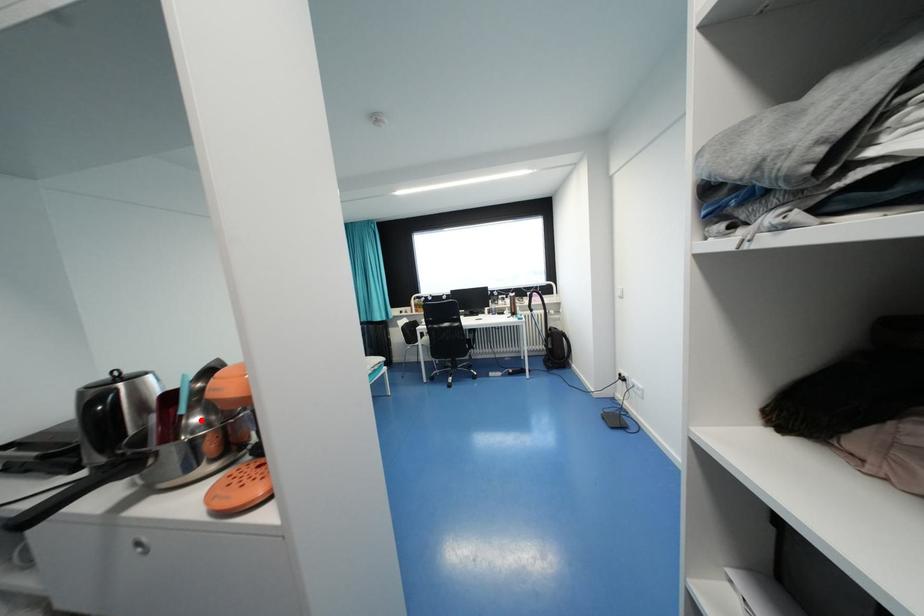
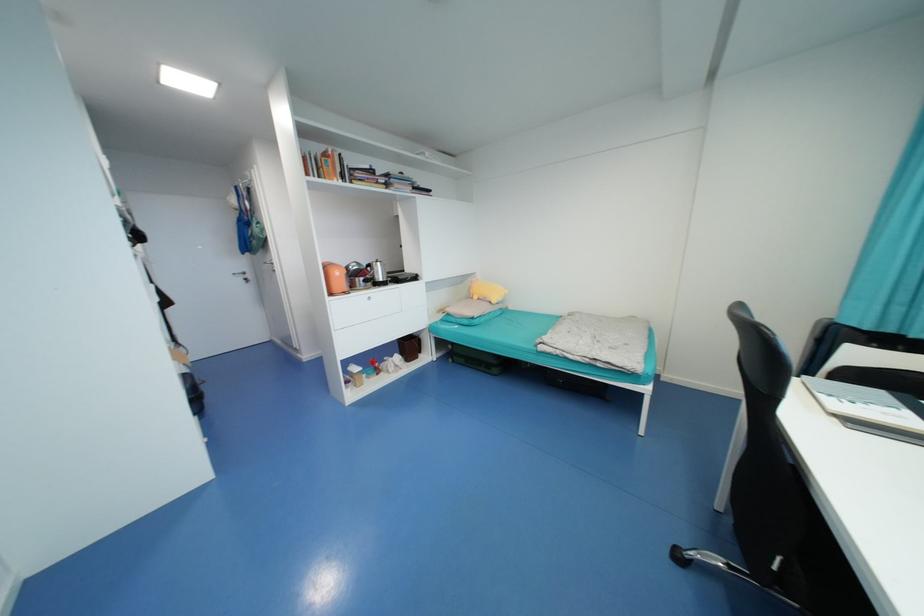
Question: I am providing you with two images of the same scene from different viewpoints. A red point is marked on the first image. At the location where the point appears in image 1, is it still visible in image 2?

Choices:
 (A) Yes
 (B) No

Answer: (B)